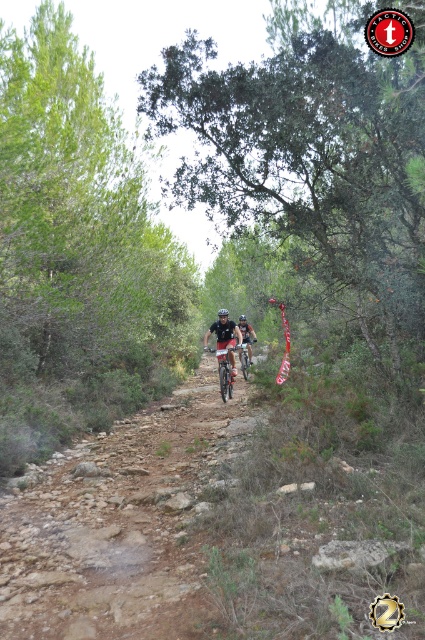
Question: Which of these objects is positioned farthest from the matte black helmet at center?

Choices:
 (A) dirt/rocky terrain at center
 (B) shiny metallic bicycle at center
 (C) metallic silver bicycle at center

Answer: (A)

Question: Which object is positioned farthest from the metallic silver bicycle at center?

Choices:
 (A) shiny metallic bicycle at center
 (B) dirt/rocky terrain at center

Answer: (B)

Question: Is dirt/rocky terrain at center thinner than matte black helmet at center?

Choices:
 (A) no
 (B) yes

Answer: (A)

Question: Is dirt/rocky terrain at center above shiny metallic bicycle at center?

Choices:
 (A) yes
 (B) no

Answer: (B)

Question: Is the position of dirt/rocky terrain at center less distant than that of shiny metallic bicycle at center?

Choices:
 (A) yes
 (B) no

Answer: (A)

Question: Which point is farther to the camera?

Choices:
 (A) matte black helmet at center
 (B) metallic silver bicycle at center
 (C) shiny metallic bicycle at center

Answer: (B)